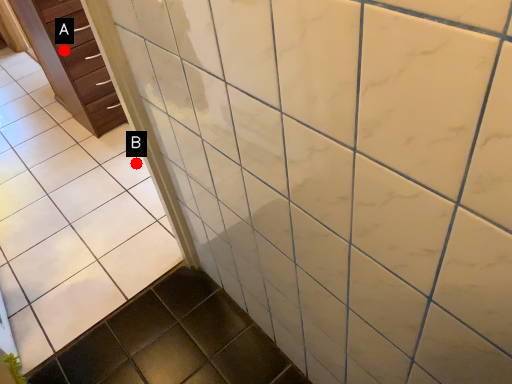
Question: Two points are circled on the image, labeled by A and B beside each circle. Which point is farther from the camera taking this photo?

Choices:
 (A) A is further
 (B) B is further

Answer: (B)